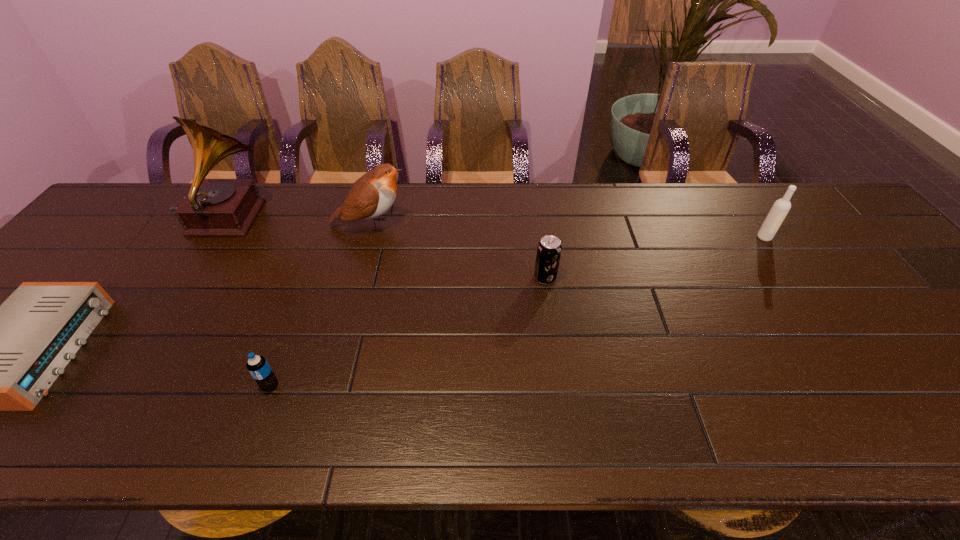
Where is `vacant space that satisfies the following two spatial constraints: 1. from the horn of the tallest object; 2. on the left side of the left soda bottle`? This screenshot has height=540, width=960. vacant space that satisfies the following two spatial constraints: 1. from the horn of the tallest object; 2. on the left side of the left soda bottle is located at coordinates (120, 386).

The height and width of the screenshot is (540, 960). Find the location of `vacant point that satisfies the following two spatial constraints: 1. from the horn of the phonograph record; 2. on the right side of the fourth shortest object`. vacant point that satisfies the following two spatial constraints: 1. from the horn of the phonograph record; 2. on the right side of the fourth shortest object is located at coordinates (215, 238).

Find the location of a particular element. vacant space that satisfies the following two spatial constraints: 1. from the horn of the vodka; 2. on the left side of the tallest object is located at coordinates (215, 238).

Locate an element on the screen. The image size is (960, 540). vacant space that satisfies the following two spatial constraints: 1. at the face of the vodka; 2. on the left side of the bird is located at coordinates (367, 238).

Find the location of a particular element. Image resolution: width=960 pixels, height=540 pixels. free spot that satisfies the following two spatial constraints: 1. on the back side of the vodka; 2. at the face of the bird is located at coordinates (756, 225).